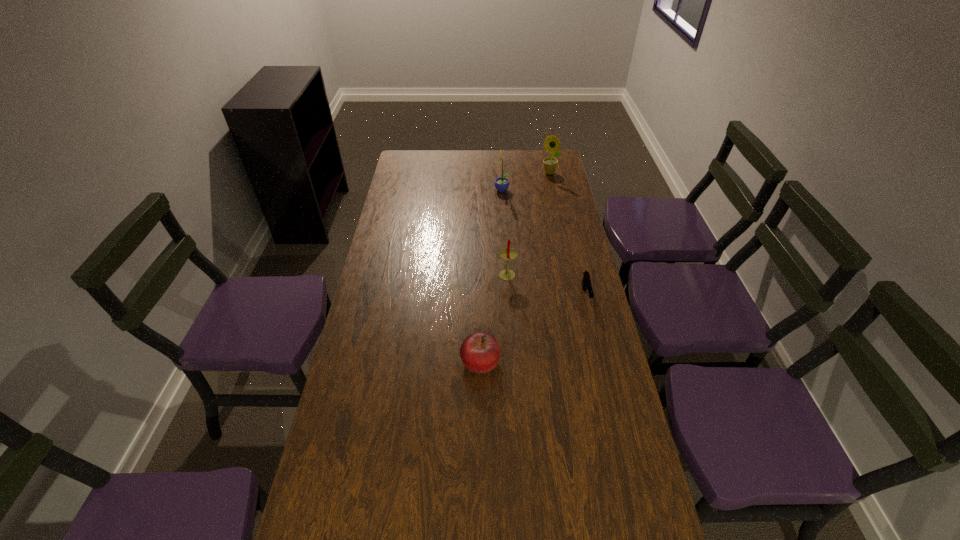
Image resolution: width=960 pixels, height=540 pixels. In order to click on vacant region at the left edge of the desktop in this screenshot , I will do `click(413, 193)`.

The image size is (960, 540). Find the location of `free space at the right edge`. free space at the right edge is located at coordinates (595, 470).

The image size is (960, 540). I want to click on free space between the third tallest object and the farther sunflower, so click(x=528, y=225).

Find the location of a particular element. This screenshot has width=960, height=540. free spot between the pistol and the candle is located at coordinates (546, 286).

The height and width of the screenshot is (540, 960). What are the coordinates of `unoccupied area between the nearest object and the candle` in the screenshot? It's located at [x=493, y=319].

The width and height of the screenshot is (960, 540). I want to click on free spot between the leftmost object and the fourth nearest object, so click(x=492, y=276).

In order to click on free space between the shortest object and the third tallest object in this screenshot , I will do `click(546, 286)`.

Where is `vacant region between the shortest object and the nearer sunflower`? vacant region between the shortest object and the nearer sunflower is located at coordinates (543, 243).

At what (x,y) coordinates should I click in order to perform the action: click on vacant space that is in between the right sunflower and the pistol. Please return your answer as a coordinate pair (x, y). The height and width of the screenshot is (540, 960). Looking at the image, I should click on [567, 234].

At what (x,y) coordinates should I click in order to perform the action: click on the fourth closest object to the farther sunflower. Please return your answer as a coordinate pair (x, y). This screenshot has width=960, height=540. Looking at the image, I should click on (480, 352).